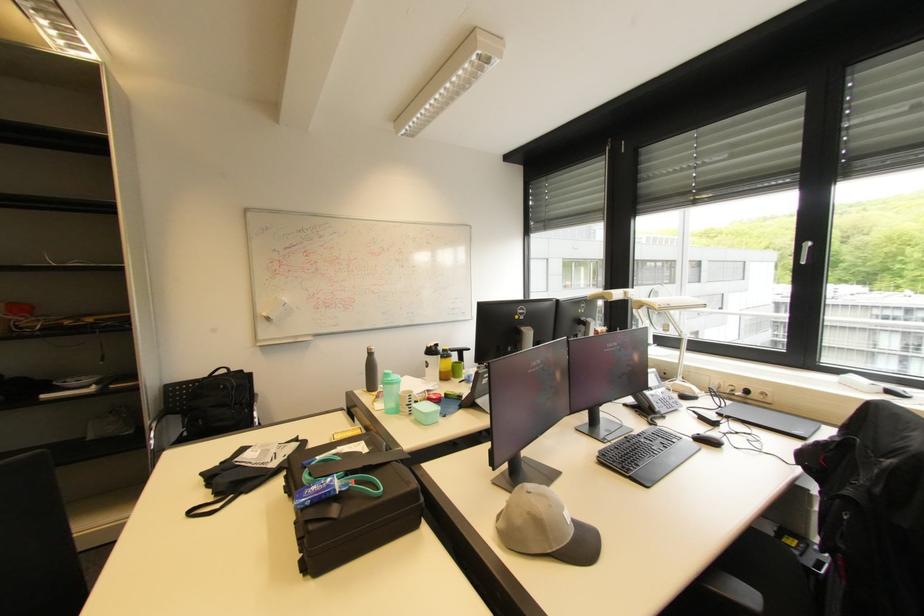
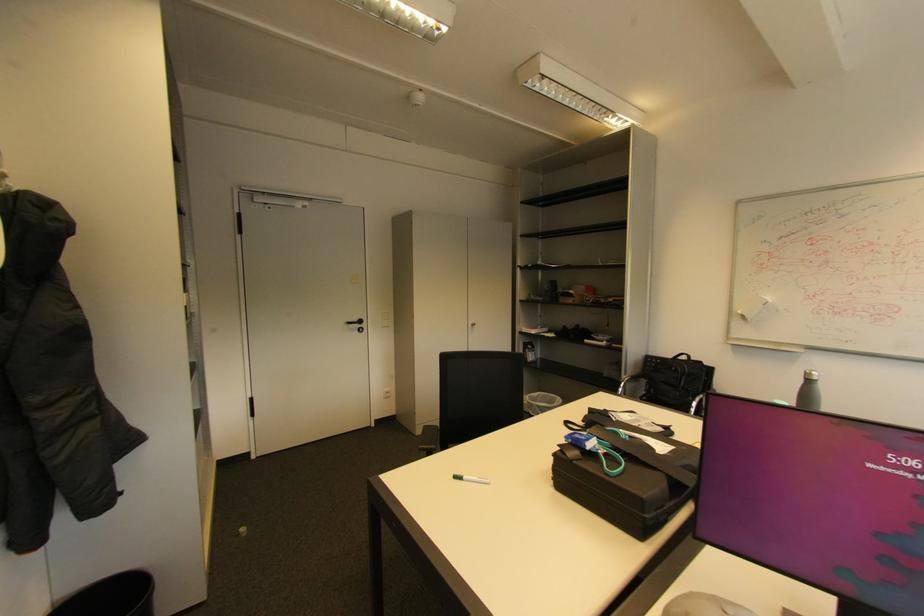
In the second image, find the point that corresponds to the point at 226,387 in the first image.

(678, 369)